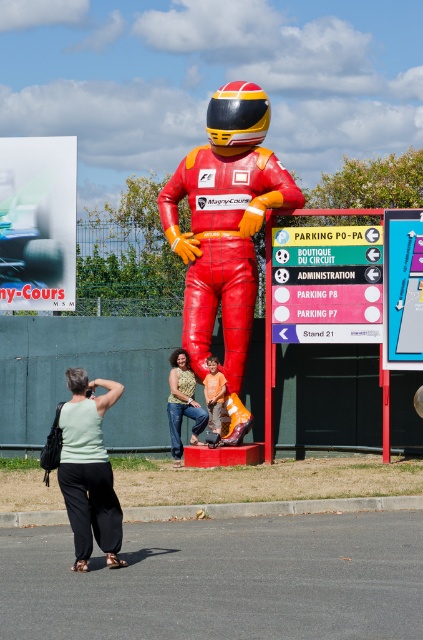
You are standing at the center of the Magny Cours venue and want to find the metallic sign at center. According to the coordinates provided, in which direction should you look to find it?

The metallic sign at center is located at coordinates point (x=326, y=284), which is slightly to the lower right from the exact center. So you should look towards the lower right direction from your current position at the center.

You are a photographer trying to capture both the metallic sign at center and the light green fabric shirt at lower left in the same frame. Based on their heights, which object should you focus on first to ensure both are in focus?

The metallic sign at center has a lesser height compared to light green fabric shirt at lower left, so you should focus on the light green fabric shirt at lower left first to ensure both are in focus.

You are a photographer at Magny Cours and want to capture a photo that includes both the metallic blue tire at upper left and the shiny black helmet at center. Which object should you adjust your camera angle to focus on first if you want to ensure both are in frame?

The metallic blue tire at upper left is positioned under the shiny black helmet at center, so you should focus on the shiny black helmet at center first to ensure the tire below it is also captured in the frame.